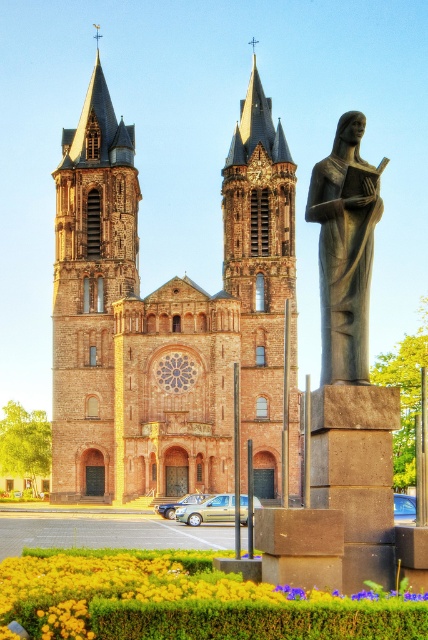
Question: Which object appears closest to the camera in this image?

Choices:
 (A) gray stone statue at right
 (B) brown stone church towers at center

Answer: (A)

Question: Does brown stone church towers at center have a greater width compared to gray stone statue at right?

Choices:
 (A) yes
 (B) no

Answer: (A)

Question: Is brown stone church towers at center below gray stone statue at right?

Choices:
 (A) yes
 (B) no

Answer: (B)

Question: Can you confirm if brown stone church towers at center is wider than gray stone statue at right?

Choices:
 (A) no
 (B) yes

Answer: (B)

Question: Among these objects, which one is farthest from the camera?

Choices:
 (A) brown stone church towers at center
 (B) gray stone statue at right

Answer: (A)